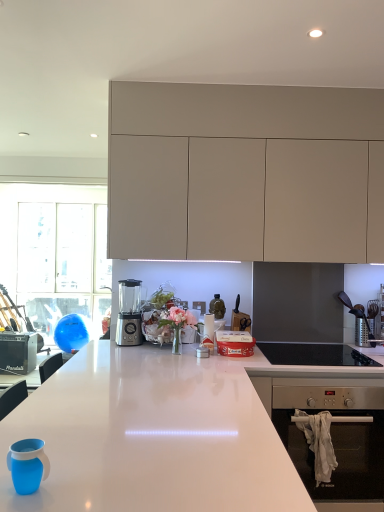
Question: Can you confirm if teal silicone cup at lower left is positioned to the left of black glass cooktop at lower right?

Choices:
 (A) yes
 (B) no

Answer: (A)

Question: From the image's perspective, does teal silicone cup at lower left appear higher than black glass cooktop at lower right?

Choices:
 (A) yes
 (B) no

Answer: (A)

Question: Does teal silicone cup at lower left have a larger size compared to black glass cooktop at lower right?

Choices:
 (A) yes
 (B) no

Answer: (B)

Question: Is teal silicone cup at lower left positioned far away from black glass cooktop at lower right?

Choices:
 (A) no
 (B) yes

Answer: (B)

Question: From the image's perspective, is teal silicone cup at lower left below black glass cooktop at lower right?

Choices:
 (A) yes
 (B) no

Answer: (B)

Question: Is teal silicone cup at lower left closer to camera compared to black glass cooktop at lower right?

Choices:
 (A) no
 (B) yes

Answer: (B)

Question: From a real-world perspective, does white glossy countertop at center stand above matte beige cabinets at upper center?

Choices:
 (A) yes
 (B) no

Answer: (B)

Question: Does white glossy countertop at center have a lesser height compared to matte beige cabinets at upper center?

Choices:
 (A) no
 (B) yes

Answer: (B)

Question: From the image's perspective, is white glossy countertop at center located beneath matte beige cabinets at upper center?

Choices:
 (A) yes
 (B) no

Answer: (A)

Question: Is white glossy countertop at center not near matte beige cabinets at upper center?

Choices:
 (A) yes
 (B) no

Answer: (A)

Question: Does white glossy countertop at center have a smaller size compared to matte beige cabinets at upper center?

Choices:
 (A) no
 (B) yes

Answer: (A)

Question: Is white glossy countertop at center oriented away from matte beige cabinets at upper center?

Choices:
 (A) yes
 (B) no

Answer: (B)

Question: Can you confirm if matte beige cabinets at upper center is taller than teal silicone cup at lower left?

Choices:
 (A) no
 (B) yes

Answer: (B)